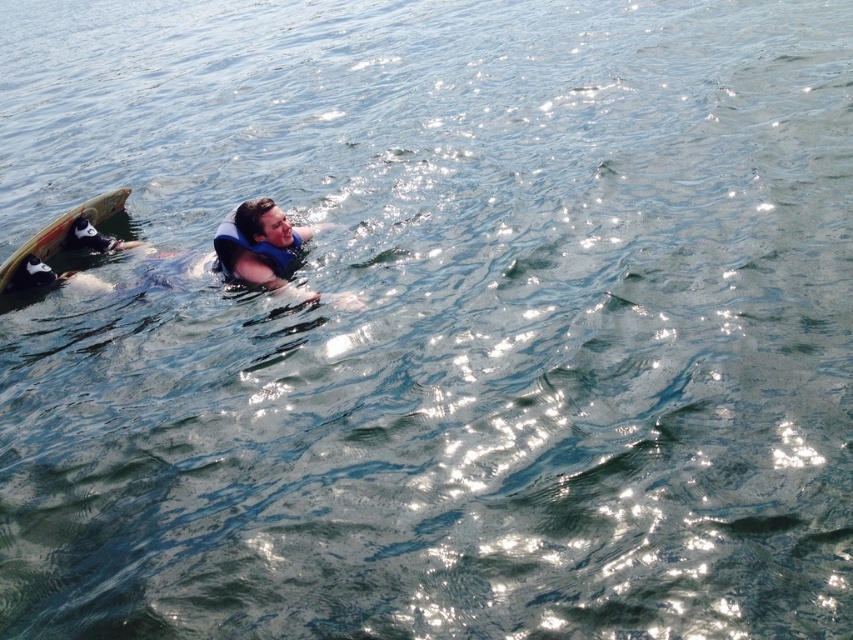
Question: Which point is closer to the camera taking this photo?

Choices:
 (A) (99, 208)
 (B) (283, 269)
 (C) (312, 227)

Answer: (B)

Question: Does blue life vest at center have a lesser width compared to blue fabric life jacket at center?

Choices:
 (A) no
 (B) yes

Answer: (A)

Question: Which object is closer to the camera taking this photo?

Choices:
 (A) blue life vest at center
 (B) wooden surfboard at left

Answer: (A)

Question: Is the position of blue life vest at center less distant than that of blue fabric life jacket at center?

Choices:
 (A) yes
 (B) no

Answer: (B)

Question: Which object appears farthest from the camera in this image?

Choices:
 (A) blue life vest at center
 (B) wooden surfboard at left

Answer: (B)

Question: Does blue life vest at center appear on the right side of wooden surfboard at left?

Choices:
 (A) yes
 (B) no

Answer: (A)